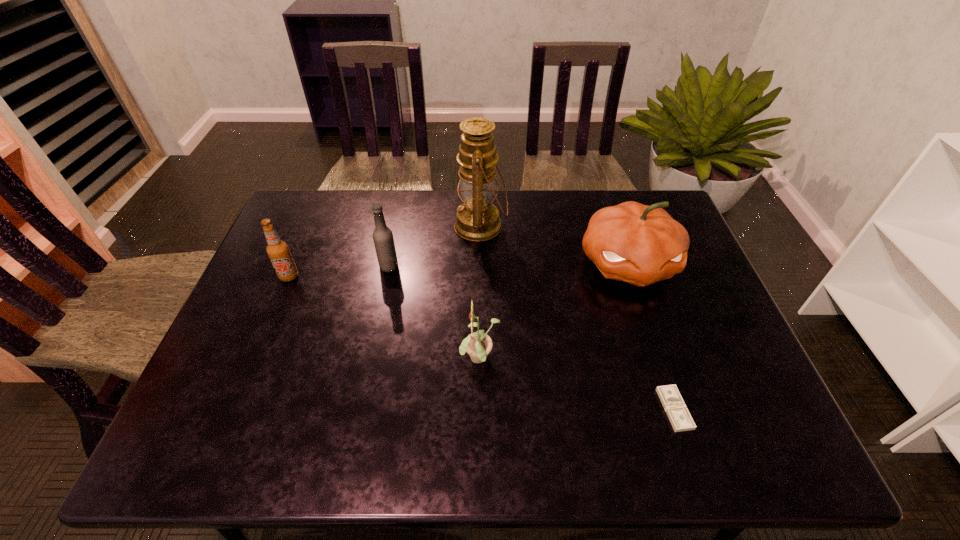
Find the location of a particular element. free region located 0.090m on the front label of the left beer bottle is located at coordinates (276, 308).

I want to click on free location located on the front-facing side of the fifth farthest object, so click(362, 360).

The width and height of the screenshot is (960, 540). Find the location of `vacant space located on the front-facing side of the fifth farthest object`. vacant space located on the front-facing side of the fifth farthest object is located at coordinates (x=296, y=360).

I want to click on free space located on the front-facing side of the fifth farthest object, so click(399, 360).

Where is `vacant space located 0.160m on the left of the nearest object`? Image resolution: width=960 pixels, height=540 pixels. vacant space located 0.160m on the left of the nearest object is located at coordinates (589, 409).

At what (x,y) coordinates should I click in order to perform the action: click on oil lamp that is at the far edge. Please return your answer as a coordinate pair (x, y). Looking at the image, I should click on (477, 219).

Locate an element on the screen. pumpkin present at the far edge is located at coordinates (638, 244).

Locate an element on the screen. The image size is (960, 540). object that is at the near edge is located at coordinates (677, 412).

Identify the location of object that is at the left edge. (278, 251).

You are a GUI agent. You are given a task and a screenshot of the screen. Output one action in this format:
    pyautogui.click(x=<x>, y=<y>)
    Task: Click on the object present at the right edge
    Image resolution: width=960 pixels, height=540 pixels.
    Given the screenshot: What is the action you would take?
    pyautogui.click(x=638, y=244)